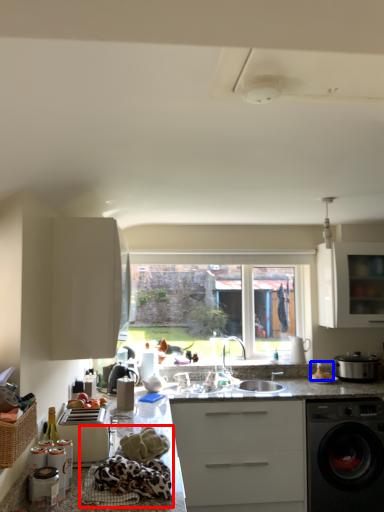
Question: Which object appears closest to the camera in this image, material (highlighted by a red box) or food (highlighted by a blue box)?

Choices:
 (A) material
 (B) food

Answer: (A)